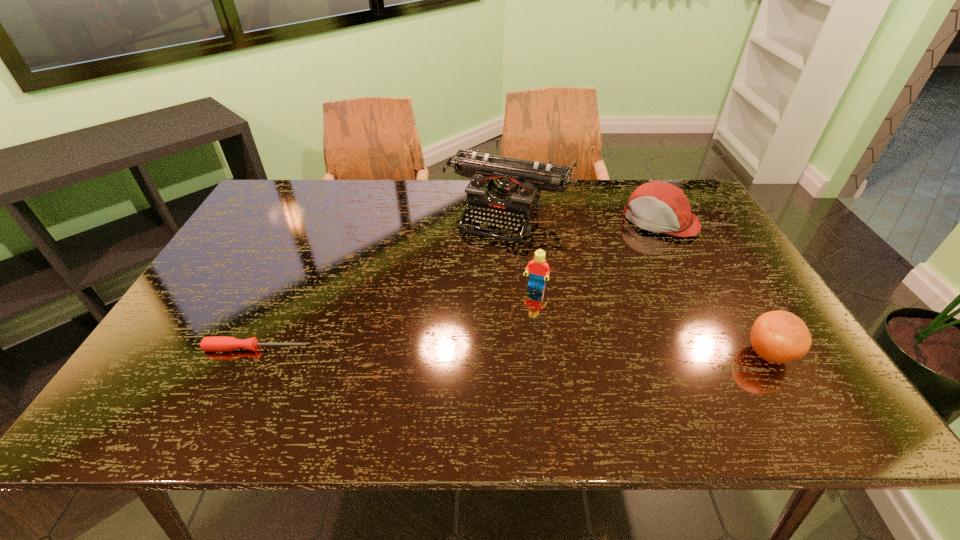
You are a GUI agent. You are given a task and a screenshot of the screen. Output one action in this format:
    pyautogui.click(x=<x>, y=<y>)
    Task: Click on the vacant space positioned on the keyboard of the tallest object
    Image resolution: width=960 pixels, height=540 pixels.
    Given the screenshot: What is the action you would take?
    pyautogui.click(x=474, y=277)

This screenshot has width=960, height=540. What are the coordinates of `vacant space positioned 0.050m on the front-facing side of the cap` in the screenshot? It's located at (641, 245).

At what (x,y) coordinates should I click in order to perform the action: click on vacant space located 0.220m on the front-facing side of the cap. Please return your answer as a coordinate pair (x, y). Image resolution: width=960 pixels, height=540 pixels. Looking at the image, I should click on (x=617, y=276).

This screenshot has width=960, height=540. Identify the location of vacant region located on the front-facing side of the cap. (597, 304).

You are a GUI agent. You are given a task and a screenshot of the screen. Output one action in this format:
    pyautogui.click(x=<x>, y=<y>)
    Task: Click on the vacant space located 0.280m on the face of the third nearest object
    
    Given the screenshot: What is the action you would take?
    pyautogui.click(x=500, y=380)

The image size is (960, 540). What are the coordinates of `blank space located on the face of the third nearest object` in the screenshot? It's located at (500, 380).

What are the coordinates of `vacant region located 0.140m on the face of the third nearest object` in the screenshot? It's located at (517, 333).

Locate an element on the screen. typewriter that is at the far edge is located at coordinates (504, 189).

Locate an element on the screen. cap that is at the far edge is located at coordinates (660, 207).

The image size is (960, 540). I want to click on screwdriver that is at the near edge, so click(217, 343).